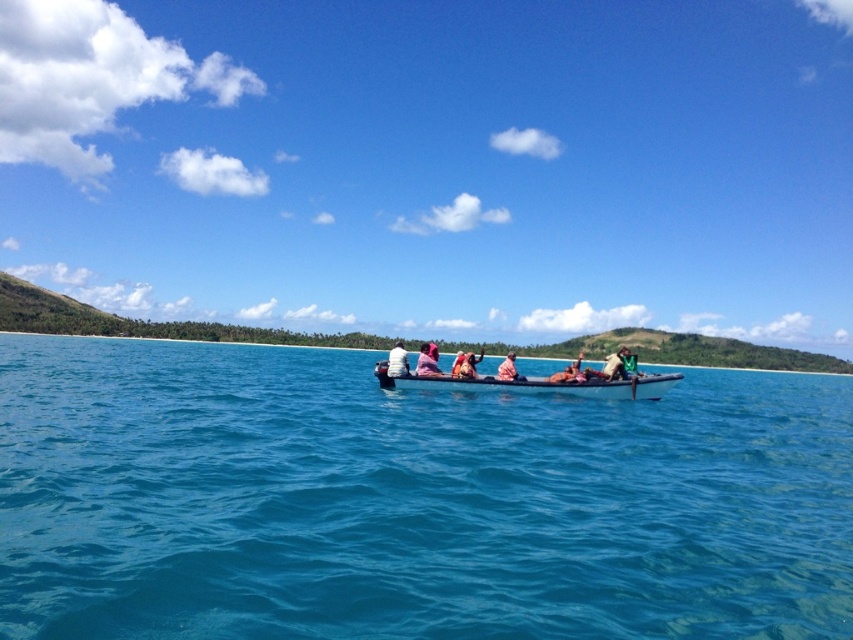
Question: Which point is farther to the camera?

Choices:
 (A) (630, 371)
 (B) (570, 381)

Answer: (A)

Question: Among these points, which one is farthest from the camera?

Choices:
 (A) (634, 374)
 (B) (563, 380)
 (C) (405, 356)

Answer: (C)

Question: Is pink fabric at center thinner than light brown wooden boat at center?

Choices:
 (A) yes
 (B) no

Answer: (A)

Question: Can you confirm if dark gray wooden canoe at center is wider than light pink fabric at center?

Choices:
 (A) no
 (B) yes

Answer: (B)

Question: Is blue water at center further to camera compared to dark gray wooden canoe at center?

Choices:
 (A) no
 (B) yes

Answer: (A)

Question: Which point is farther to the camera?

Choices:
 (A) pink fabric at center
 (B) light pink fabric at center
 (C) white fabric at center

Answer: (A)